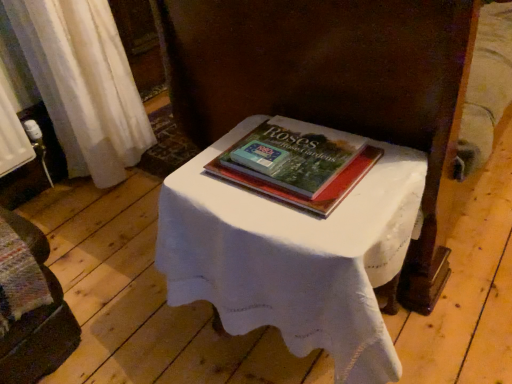
Question: Is the position of white cloth-covered table at center more distant than that of wooden bench at lower left?

Choices:
 (A) no
 (B) yes

Answer: (A)

Question: Is white cloth-covered table at center in front of wooden bench at lower left?

Choices:
 (A) yes
 (B) no

Answer: (A)

Question: Is white cloth-covered table at center outside of wooden bench at lower left?

Choices:
 (A) no
 (B) yes

Answer: (B)

Question: From the image's perspective, is white cloth-covered table at center located above wooden bench at lower left?

Choices:
 (A) yes
 (B) no

Answer: (A)

Question: Does white cloth-covered table at center have a larger size compared to wooden bench at lower left?

Choices:
 (A) yes
 (B) no

Answer: (A)

Question: From the image's perspective, would you say white cloth-covered table at center is shown under wooden bench at lower left?

Choices:
 (A) no
 (B) yes

Answer: (A)

Question: From a real-world perspective, is wooden bench at lower left positioned under white cloth-covered table at center based on gravity?

Choices:
 (A) no
 (B) yes

Answer: (B)

Question: Is the position of wooden bench at lower left less distant than that of white cloth-covered table at center?

Choices:
 (A) no
 (B) yes

Answer: (A)

Question: From the image's perspective, is wooden bench at lower left on top of white cloth-covered table at center?

Choices:
 (A) no
 (B) yes

Answer: (A)

Question: Can you confirm if wooden bench at lower left is bigger than white cloth-covered table at center?

Choices:
 (A) yes
 (B) no

Answer: (B)

Question: Is wooden bench at lower left oriented towards white cloth-covered table at center?

Choices:
 (A) no
 (B) yes

Answer: (A)

Question: From a real-world perspective, is wooden bench at lower left over white cloth-covered table at center?

Choices:
 (A) yes
 (B) no

Answer: (B)

Question: Does wooden bench at lower left have a larger size compared to hardcover book at center?

Choices:
 (A) yes
 (B) no

Answer: (A)